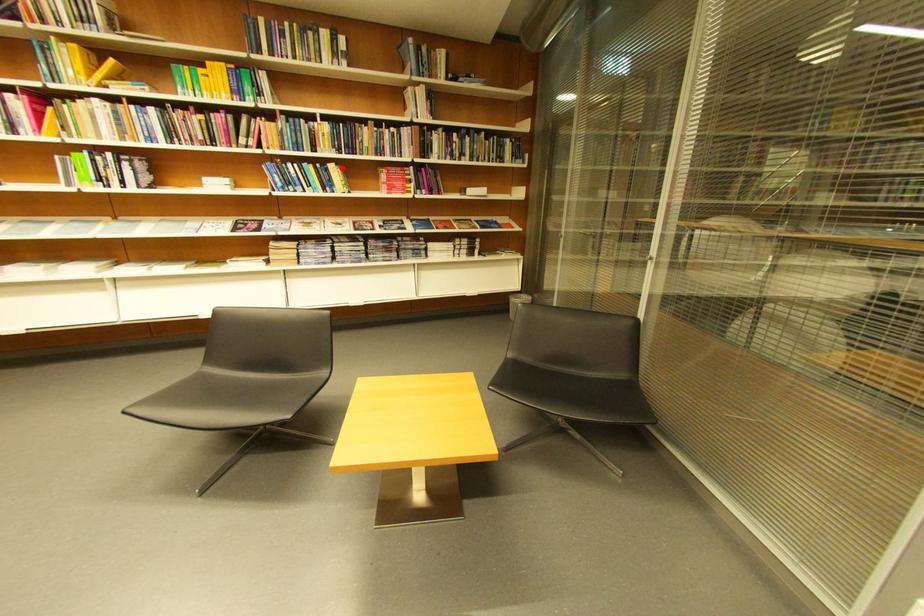
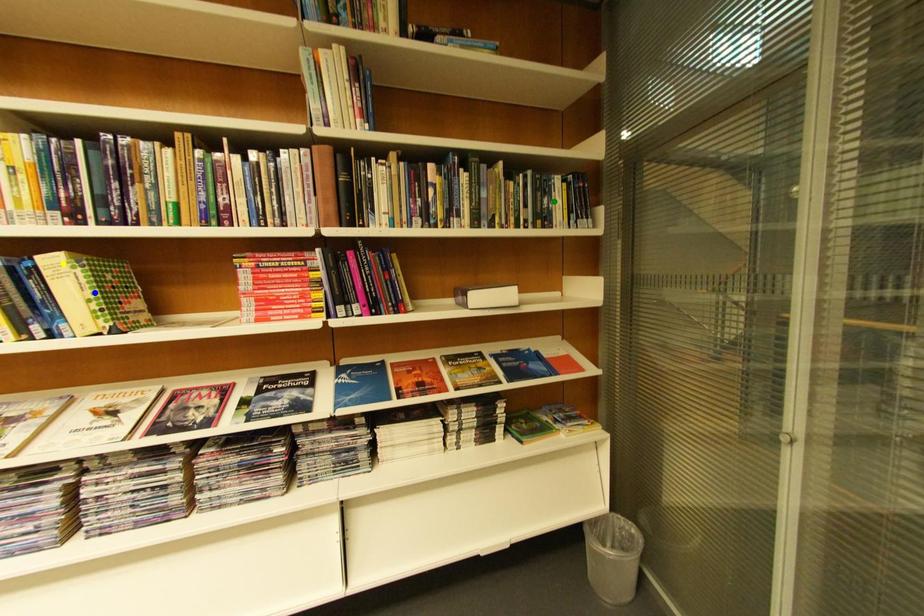
Question: I am providing you with two images of the same scene from different viewpoints. A red point is marked on the first image. You are given multiple points on the second image. Which point in image 2 is actually the same real-world point as the red point in image 1?

Choices:
 (A) blue point
 (B) green point
 (C) yellow point

Answer: (C)